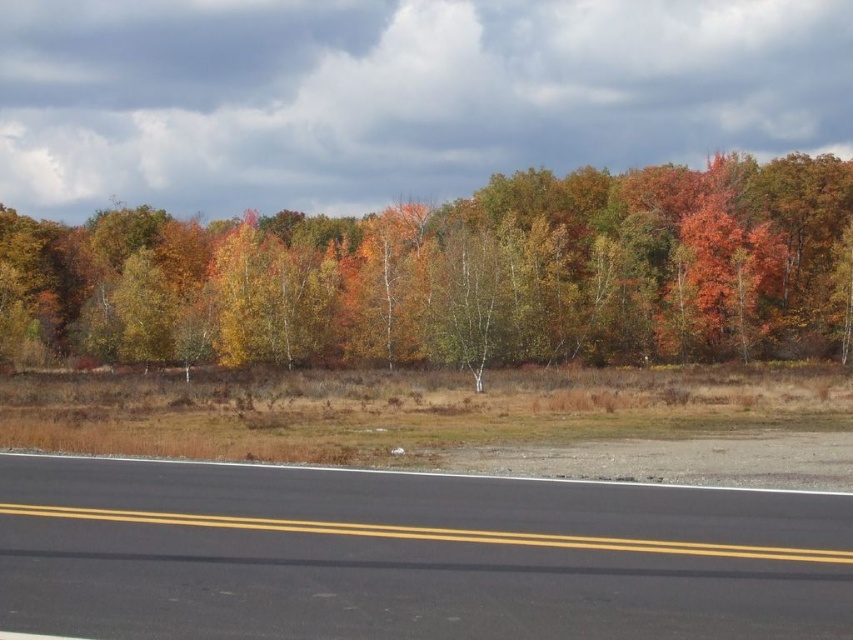
Question: Is autumn leaves at upper center behind black asphalt road at lower center?

Choices:
 (A) yes
 (B) no

Answer: (A)

Question: Among these points, which one is farthest from the camera?

Choices:
 (A) (750, 296)
 (B) (821, 548)

Answer: (A)

Question: From the image, what is the correct spatial relationship of autumn leaves at upper center in relation to black asphalt road at lower center?

Choices:
 (A) below
 (B) above

Answer: (B)

Question: From the image, what is the correct spatial relationship of autumn leaves at upper center in relation to black asphalt road at lower center?

Choices:
 (A) above
 (B) below

Answer: (A)